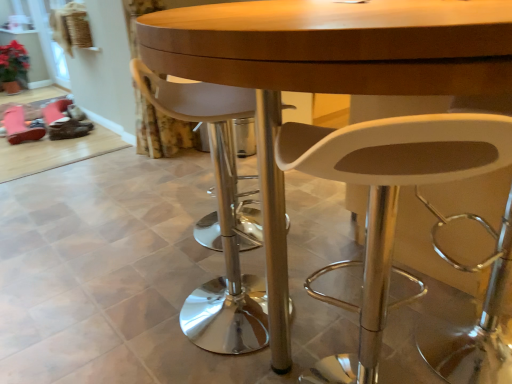
Locate an element on the screen. vacant space underneath matte wood table at center (from a real-world perspective) is located at coordinates (342, 292).